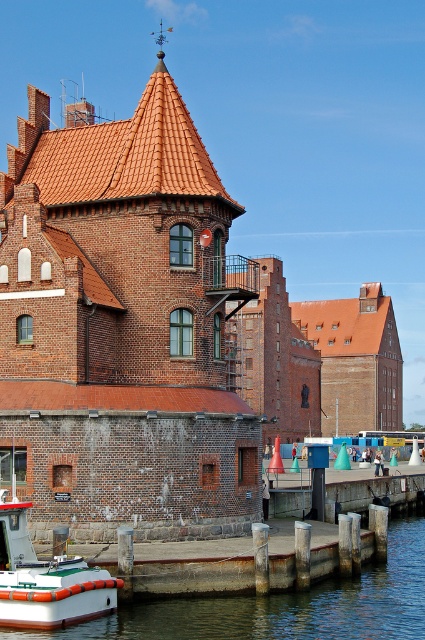
Question: Does smooth concrete water at lower left have a lesser width compared to white rubber boat at lower left?

Choices:
 (A) no
 (B) yes

Answer: (A)

Question: Which of the following is the closest to the observer?

Choices:
 (A) white rubber boat at lower left
 (B) smooth concrete water at lower left

Answer: (B)

Question: Is smooth concrete water at lower left bigger than white rubber boat at lower left?

Choices:
 (A) yes
 (B) no

Answer: (A)

Question: Is smooth concrete water at lower left bigger than white rubber boat at lower left?

Choices:
 (A) no
 (B) yes

Answer: (B)